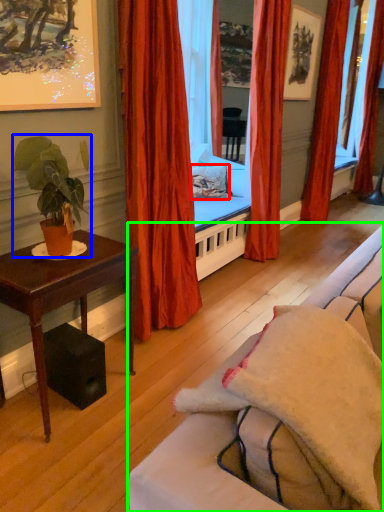
Question: Which object is the farthest from pillow (highlighted by a red box)? Choose among these: houseplant (highlighted by a blue box) or studio couch (highlighted by a green box).

Choices:
 (A) houseplant
 (B) studio couch

Answer: (B)